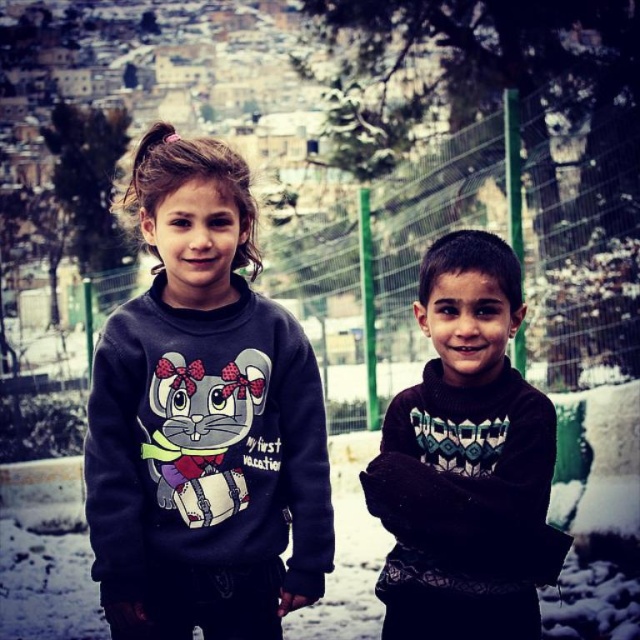
Which of these two, matte dark blue sweatshirt at center or black knitted sweater at right, stands shorter?

With less height is black knitted sweater at right.

Is point (253, 260) positioned behind point (545, 454)?

That is True.

What do you see at coordinates (204, 420) in the screenshot? Image resolution: width=640 pixels, height=640 pixels. I see `matte dark blue sweatshirt at center` at bounding box center [204, 420].

I want to click on matte dark blue sweatshirt at center, so click(x=204, y=420).